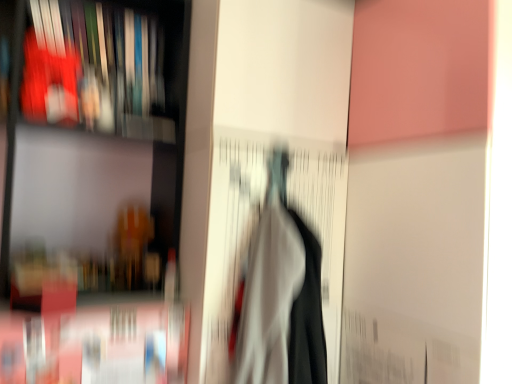
Question: From the image's perspective, does white fabric at center appear lower than matte plastic book at upper left?

Choices:
 (A) yes
 (B) no

Answer: (A)

Question: Can you confirm if white fabric at center is taller than matte plastic book at upper left?

Choices:
 (A) no
 (B) yes

Answer: (B)

Question: Considering the relative sizes of white fabric at center and matte plastic book at upper left in the image provided, is white fabric at center bigger than matte plastic book at upper left?

Choices:
 (A) no
 (B) yes

Answer: (B)

Question: Is white fabric at center behind matte plastic book at upper left?

Choices:
 (A) no
 (B) yes

Answer: (A)

Question: From a real-world perspective, is white fabric at center over matte plastic book at upper left?

Choices:
 (A) yes
 (B) no

Answer: (B)

Question: Is matte plastic book at upper left wider or thinner than matte black bookshelf at left?

Choices:
 (A) thin
 (B) wide

Answer: (A)

Question: Relative to matte black bookshelf at left, is matte plastic book at upper left in front or behind?

Choices:
 (A) front
 (B) behind

Answer: (B)

Question: In terms of height, does matte plastic book at upper left look taller or shorter compared to matte black bookshelf at left?

Choices:
 (A) tall
 (B) short

Answer: (B)

Question: Is matte plastic book at upper left inside the boundaries of matte black bookshelf at left, or outside?

Choices:
 (A) inside
 (B) outside

Answer: (A)

Question: Do you think matte black bookshelf at left is within matte plastic book at upper left, or outside of it?

Choices:
 (A) inside
 (B) outside

Answer: (B)

Question: From the image's perspective, relative to matte plastic book at upper left, is matte black bookshelf at left above or below?

Choices:
 (A) below
 (B) above

Answer: (A)

Question: In terms of size, does matte black bookshelf at left appear bigger or smaller than matte plastic book at upper left?

Choices:
 (A) small
 (B) big

Answer: (B)

Question: From a real-world perspective, is matte black bookshelf at left physically located above or below matte plastic book at upper left?

Choices:
 (A) below
 (B) above

Answer: (A)

Question: Is white fabric at center to the left or to the right of matte black bookshelf at left in the image?

Choices:
 (A) left
 (B) right

Answer: (B)

Question: Is white fabric at center inside the boundaries of matte black bookshelf at left, or outside?

Choices:
 (A) outside
 (B) inside

Answer: (A)